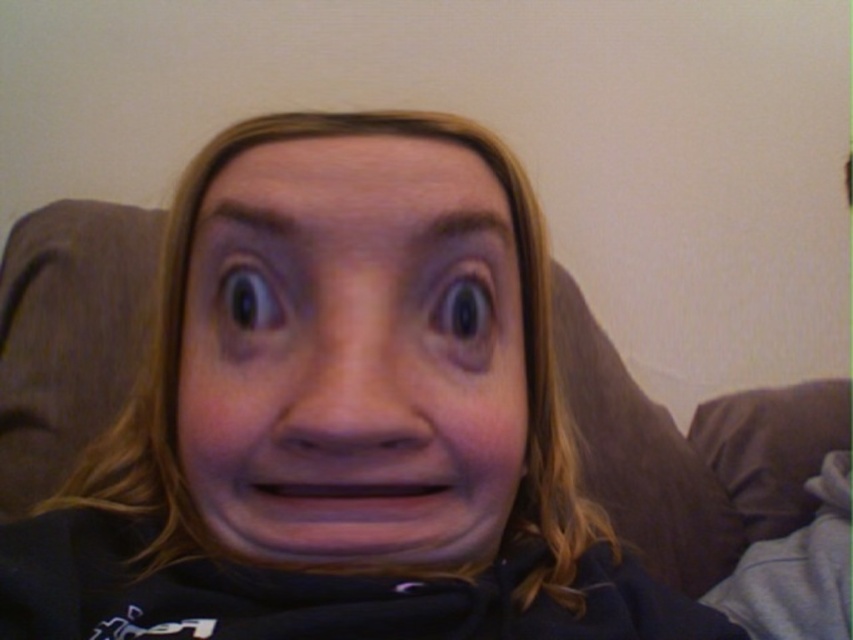
You are an artist sketching the person in the image. You need to decide which eye to focus on first based on their position. Which eye is closer to you, the shiny brown eye at center or the black glossy eye at upper left?

The shiny brown eye at center is closer to you because it is further to the viewer than the black glossy eye at upper left.

In the scene shown: You are a photographer adjusting your camera to focus on two points in the image. The first point is point (399, 460) and the second is point (426, 342). Which point should you focus on first if you want to capture the subject in the foreground?

Point (399, 460) should be focused on first because it is in front of point (426, 342), making it closer to the camera and part of the foreground.

You are a photographer adjusting the focus of your camera. The subject has a smooth skin face at center and a black glossy eye at upper left. If your camera can only focus on one object at a time, which object should you focus on to ensure the face is sharp?

You should focus on the smooth skin face at center because it is the main subject and the black glossy eye at upper left is part of the face, so focusing on the face will naturally include the eye in the sharp area.